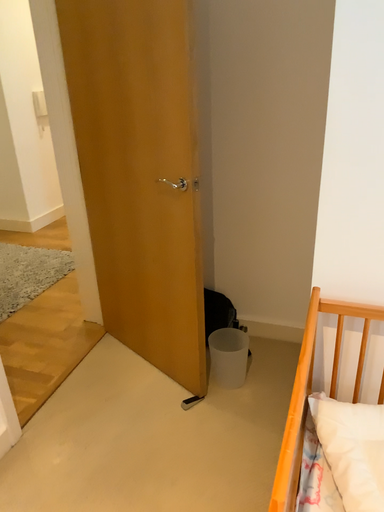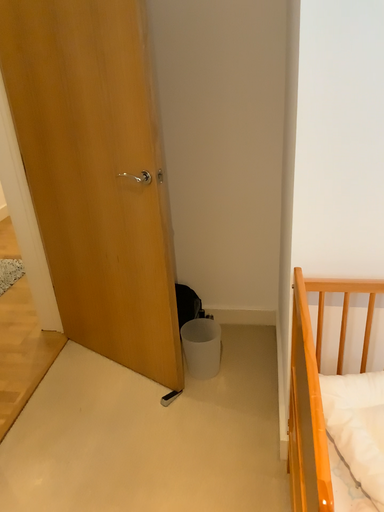
Question: How did the camera likely rotate when shooting the video?

Choices:
 (A) rotated left
 (B) rotated right

Answer: (B)